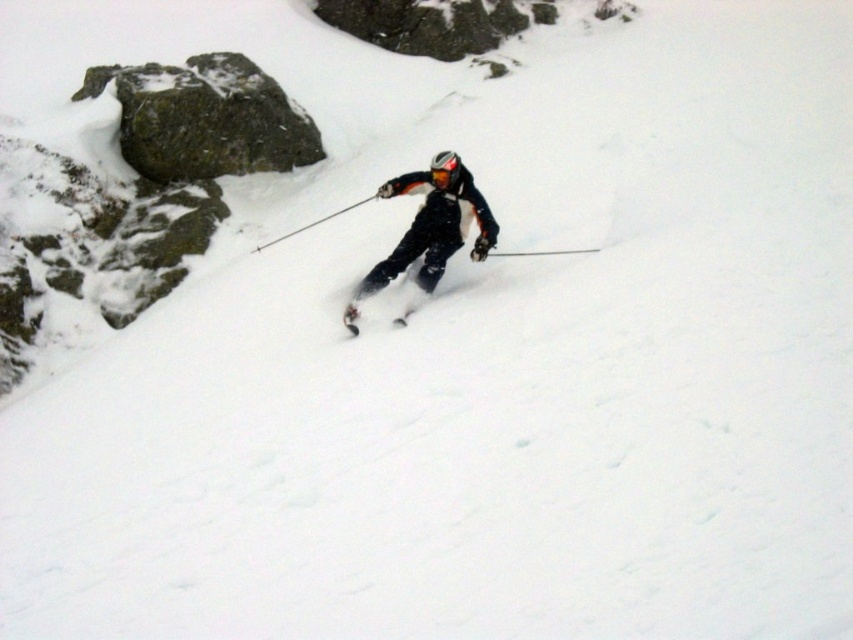
Question: Is matte black ski suit at center thinner than metallic ski pole at center?

Choices:
 (A) no
 (B) yes

Answer: (B)

Question: Among these objects, which one is nearest to the camera?

Choices:
 (A) metallic ski pole at center
 (B) matte black ski suit at center
 (C) matte black ski at center

Answer: (B)

Question: Does matte black ski at center have a smaller size compared to metallic ski pole at center?

Choices:
 (A) yes
 (B) no

Answer: (A)

Question: Considering the real-world distances, which object is farthest from the metallic ski pole at center?

Choices:
 (A) matte black ski suit at center
 (B) matte black ski at center

Answer: (B)

Question: Does matte black ski suit at center appear on the left side of metallic ski pole at center?

Choices:
 (A) no
 (B) yes

Answer: (A)

Question: Which of the following is the closest to the observer?

Choices:
 (A) (253, 252)
 (B) (496, 230)

Answer: (B)